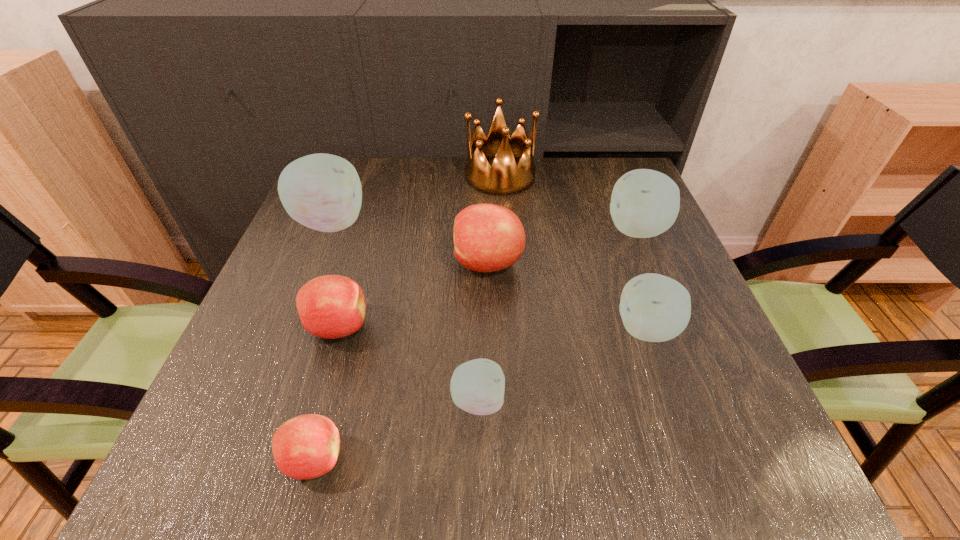
Where is `empty space that is in between the second nearest red apple and the nearest white apple`? This screenshot has width=960, height=540. empty space that is in between the second nearest red apple and the nearest white apple is located at coordinates (408, 364).

Image resolution: width=960 pixels, height=540 pixels. I want to click on free space between the nearest apple and the farthest red apple, so click(x=400, y=361).

Identify which object is the fifth nearest to the second farthest red apple. Please provide its 2D coordinates. Your answer should be formatted as a tuple, i.e. [(x, y)], where the tuple contains the x and y coordinates of a point satisfying the conditions above.

[(504, 177)]

Locate an element on the screen. object that is the sixth closest to the tallest apple is located at coordinates (655, 308).

Point out which apple is positioned as the second nearest to the biggest white apple. Please provide its 2D coordinates. Your answer should be formatted as a tuple, i.e. [(x, y)], where the tuple contains the x and y coordinates of a point satisfying the conditions above.

[(487, 237)]

The image size is (960, 540). I want to click on apple object that ranks as the second closest to the second biggest red apple, so click(x=487, y=237).

Identify which white apple is located as the nearest to the second smallest red apple. Please provide its 2D coordinates. Your answer should be formatted as a tuple, i.e. [(x, y)], where the tuple contains the x and y coordinates of a point satisfying the conditions above.

[(477, 386)]

Locate an element on the screen. The width and height of the screenshot is (960, 540). the second closest white apple to the second biggest white apple is located at coordinates (477, 386).

Where is `red apple that stands as the closest to the third smallest white apple`? The height and width of the screenshot is (540, 960). red apple that stands as the closest to the third smallest white apple is located at coordinates (487, 237).

Select which red apple is the closest to the tallest apple. Please provide its 2D coordinates. Your answer should be formatted as a tuple, i.e. [(x, y)], where the tuple contains the x and y coordinates of a point satisfying the conditions above.

[(331, 306)]